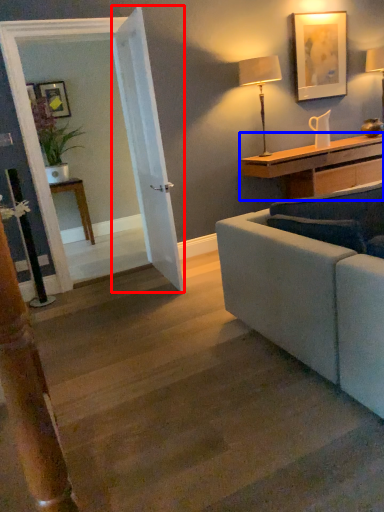
Question: Which point is further to the camera, door (highlighted by a red box) or desk (highlighted by a blue box)?

Choices:
 (A) door
 (B) desk

Answer: (B)